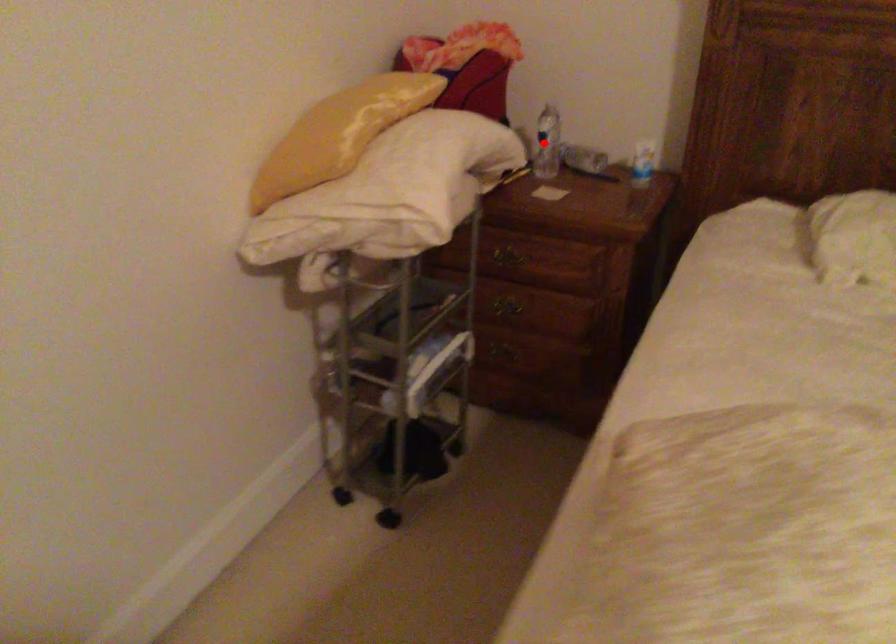
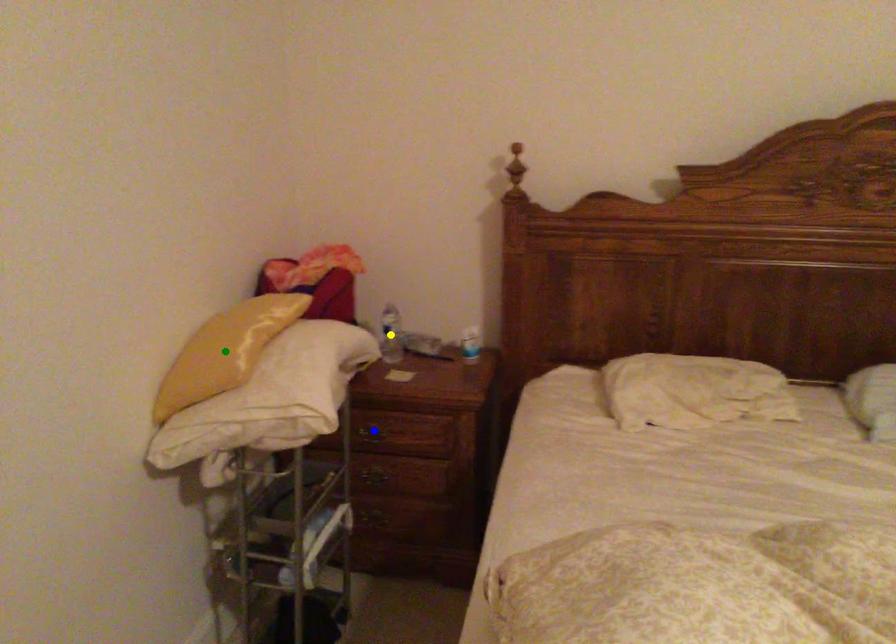
Question: I am providing you with two images of the same scene from different viewpoints. A red point is marked on the first image. You are given multiple points on the second image. Which point in image 2 is actually the same real-world point as the red point in image 1?

Choices:
 (A) green point
 (B) yellow point
 (C) blue point

Answer: (B)